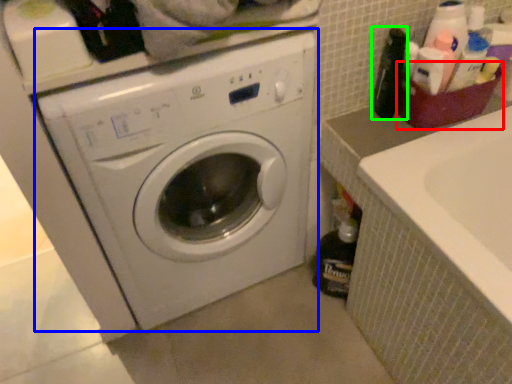
Question: Estimate the real-world distances between objects in this image. Which object is farther from basket (highlighted by a red box), washing machine (highlighted by a blue box) or bottle (highlighted by a green box)?

Choices:
 (A) washing machine
 (B) bottle

Answer: (A)